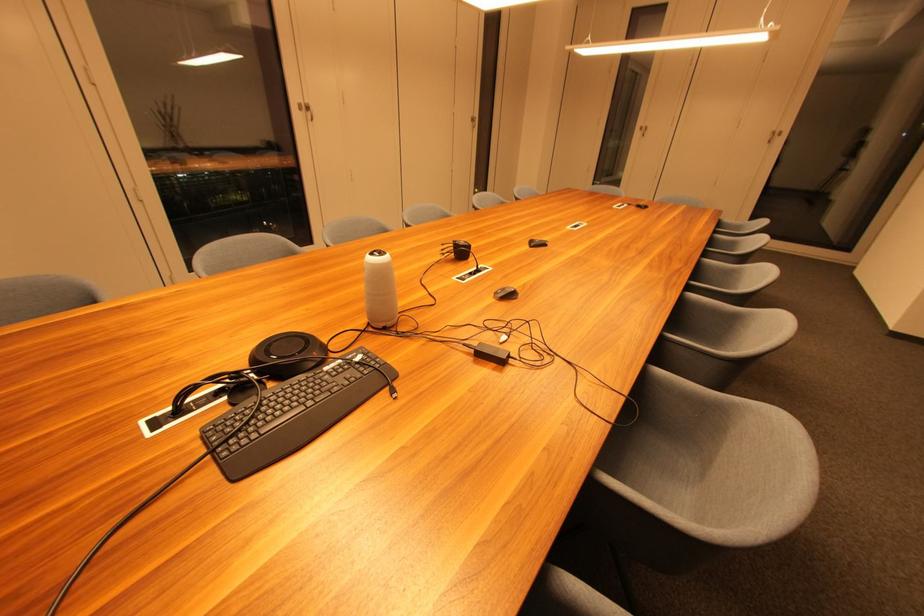
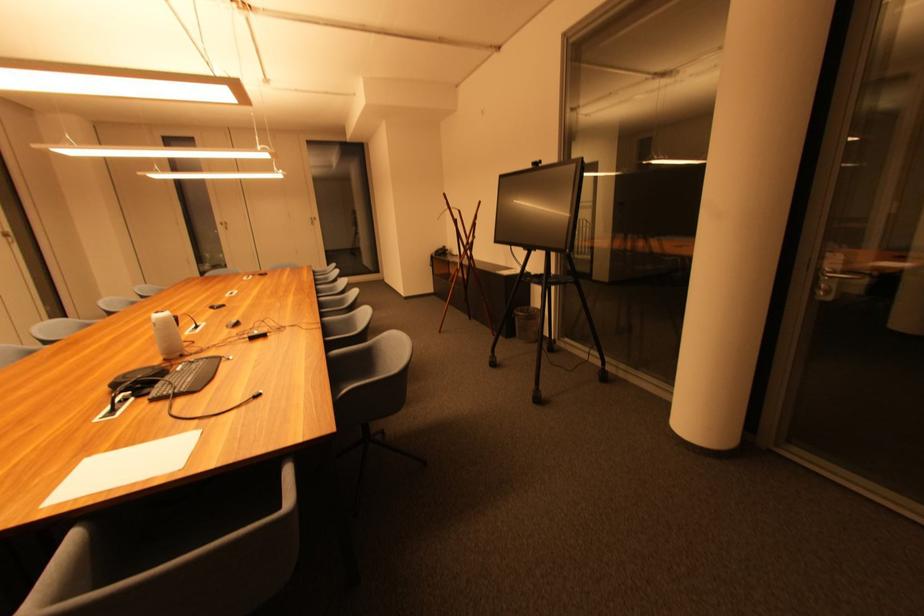
Locate, in the second image, the point that corresponds to (646,130) in the first image.

(226, 225)